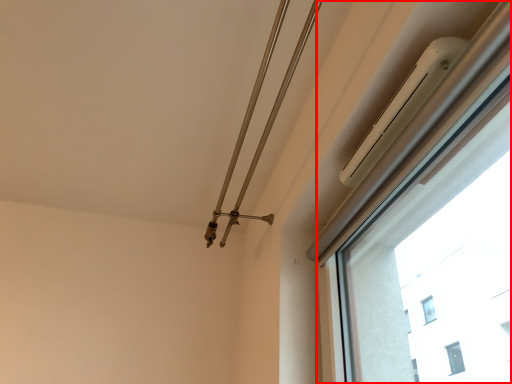
Question: From the image's perspective, what is the correct spatial positioning of window (annotated by the red box) in reference to twin?

Choices:
 (A) above
 (B) below

Answer: (A)